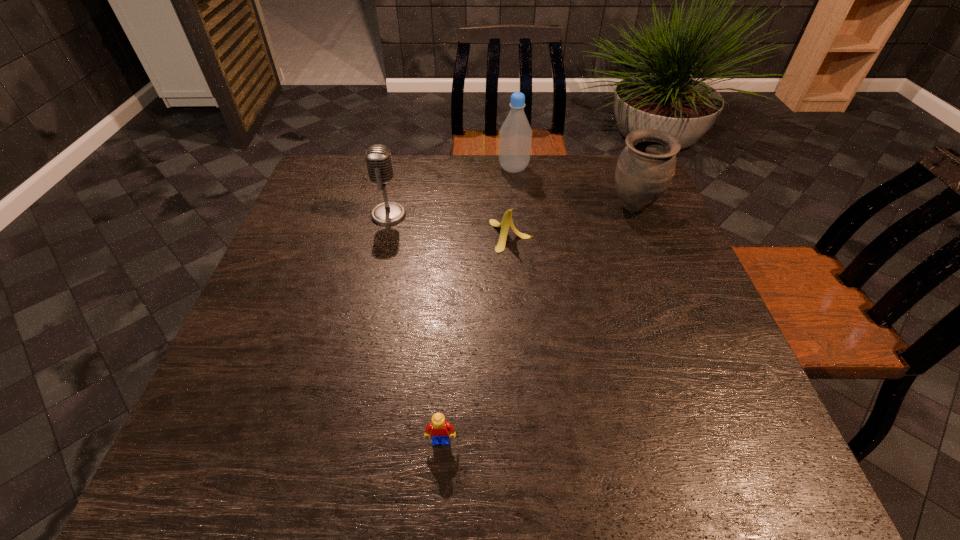
Image resolution: width=960 pixels, height=540 pixels. Find the location of `free space at the far right corner of the desktop`. free space at the far right corner of the desktop is located at coordinates (613, 178).

The width and height of the screenshot is (960, 540). In order to click on vacant point located between the rightmost object and the bottle in this screenshot , I will do `click(573, 188)`.

The image size is (960, 540). I want to click on vacant point located between the bottle and the fourth tallest object, so click(513, 202).

What are the coordinates of `unoccupied area between the fourth tallest object and the nearest object` in the screenshot? It's located at (476, 338).

At what (x,y) coordinates should I click in order to perform the action: click on vacant point located between the leftmost object and the shortest object. Please return your answer as a coordinate pair (x, y). This screenshot has height=540, width=960. Looking at the image, I should click on (415, 328).

Identify the location of unoccupied area between the microphone and the second shortest object. (450, 225).

The height and width of the screenshot is (540, 960). In order to click on vacant space that's between the Lego and the leftmost object in this screenshot , I will do `click(415, 328)`.

What are the coordinates of `vacant area between the banana and the fourth object from right to left` in the screenshot? It's located at (476, 338).

This screenshot has width=960, height=540. I want to click on free point between the leftmost object and the Lego, so click(x=415, y=328).

I want to click on free point between the leftmost object and the banana, so click(x=450, y=225).